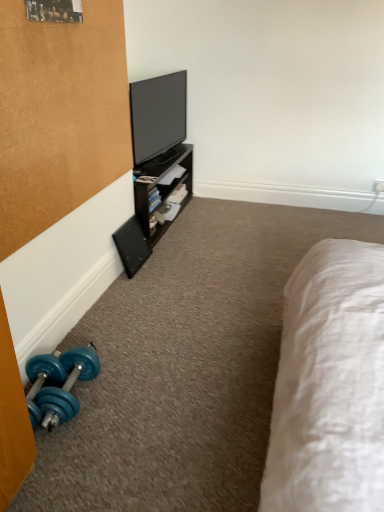
Where is `black matte speaker at lower left`? The image size is (384, 512). black matte speaker at lower left is located at coordinates (132, 246).

This screenshot has height=512, width=384. I want to click on flat screen tv at upper center, so click(x=157, y=115).

The width and height of the screenshot is (384, 512). I want to click on blue rubber dumbbell at lower left, so coord(58,384).

Is black matte speaker at lower left situated inside blue rubber dumbbell at lower left or outside?

black matte speaker at lower left is not enclosed by blue rubber dumbbell at lower left.

Looking at this image, from the image's perspective, is black matte speaker at lower left under blue rubber dumbbell at lower left?

Incorrect, from the image's perspective, black matte speaker at lower left is higher than blue rubber dumbbell at lower left.

Who is more distant, black matte speaker at lower left or blue rubber dumbbell at lower left?

black matte speaker at lower left is behind.

Between black matte speaker at lower left and blue rubber dumbbell at lower left, which one has larger size?

Bigger between the two is blue rubber dumbbell at lower left.

How different are the orientations of blue rubber dumbbell at lower left and black matte speaker at lower left in degrees?

4.04 degrees separate the facing orientations of blue rubber dumbbell at lower left and black matte speaker at lower left.

Consider the image. Can you confirm if blue rubber dumbbell at lower left is thinner than black matte speaker at lower left?

No.

Which point is more distant from viewer, (95, 364) or (141, 256)?

The point (141, 256) is farther.

Which object is positioned more to the right, blue rubber dumbbell at lower left or black matte speaker at lower left?

black matte speaker at lower left is more to the right.

Consider the image. Is blue rubber dumbbell at lower left aimed at flat screen tv at upper center?

No, blue rubber dumbbell at lower left is not aimed at flat screen tv at upper center.

Is blue rubber dumbbell at lower left to the left or to the right of flat screen tv at upper center in the image?

blue rubber dumbbell at lower left is positioned on flat screen tv at upper center's left side.

Is point (54, 406) positioned after point (138, 90)?

That is False.

Does point (162, 117) lie behind point (73, 378)?

Yes, point (162, 117) is farther from viewer.

Is flat screen tv at upper center in front of or behind blue rubber dumbbell at lower left in the image?

In the image, flat screen tv at upper center appears behind blue rubber dumbbell at lower left.

Can you confirm if flat screen tv at upper center is wider than blue rubber dumbbell at lower left?

In fact, flat screen tv at upper center might be narrower than blue rubber dumbbell at lower left.

You are a GUI agent. You are given a task and a screenshot of the screen. Output one action in this format:
    pyautogui.click(x=<x>, y=<y>)
    Task: Click on the speaker below the flat screen tv at upper center (from a real-world perspective)
    
    Given the screenshot: What is the action you would take?
    pyautogui.click(x=132, y=246)

Does flat screen tv at upper center have a larger size compared to black matte speaker at lower left?

Yes.

From a real-world perspective, between flat screen tv at upper center and black matte speaker at lower left, who is vertically lower?

black matte speaker at lower left, from a real-world perspective.

Between black matte speaker at lower left and flat screen tv at upper center, which one appears on the left side from the viewer's perspective?

From the viewer's perspective, black matte speaker at lower left appears more on the left side.

Which of these two, black matte speaker at lower left or flat screen tv at upper center, is thinner?

Thinner between the two is black matte speaker at lower left.

Is black matte speaker at lower left directly adjacent to flat screen tv at upper center?

No.

From the image's perspective, is black matte speaker at lower left positioned above or below flat screen tv at upper center?

Clearly, from the image's perspective, black matte speaker at lower left is below flat screen tv at upper center.

The width and height of the screenshot is (384, 512). I want to click on dumbbell in front of the black matte speaker at lower left, so click(58, 384).

The height and width of the screenshot is (512, 384). I want to click on speaker that appears above the blue rubber dumbbell at lower left (from a real-world perspective), so click(132, 246).

Based on their spatial positions, is blue rubber dumbbell at lower left or black matte speaker at lower left further from flat screen tv at upper center?

blue rubber dumbbell at lower left is further to flat screen tv at upper center.

Looking at the image, which one is located further to blue rubber dumbbell at lower left, black matte speaker at lower left or flat screen tv at upper center?

Among the two, flat screen tv at upper center is located further to blue rubber dumbbell at lower left.

Considering their positions, is black matte speaker at lower left positioned further to flat screen tv at upper center than blue rubber dumbbell at lower left?

blue rubber dumbbell at lower left is further to flat screen tv at upper center.

From the image, which object appears to be farther from black matte speaker at lower left, blue rubber dumbbell at lower left or flat screen tv at upper center?

The object further to black matte speaker at lower left is blue rubber dumbbell at lower left.

Considering their positions, is flat screen tv at upper center positioned further to black matte speaker at lower left than blue rubber dumbbell at lower left?

blue rubber dumbbell at lower left lies further to black matte speaker at lower left than the other object.

When comparing their distances from blue rubber dumbbell at lower left, does flat screen tv at upper center or black matte speaker at lower left seem further?

flat screen tv at upper center is further to blue rubber dumbbell at lower left.

I want to click on speaker between flat screen tv at upper center and blue rubber dumbbell at lower left in the up-down direction, so click(132, 246).